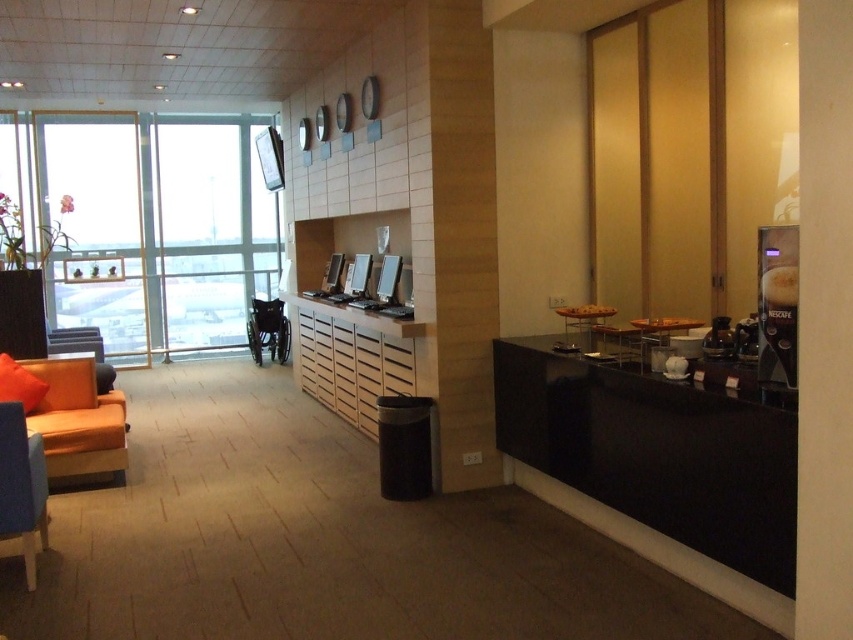
In the scene shown: Can you confirm if blue fabric chair at lower left is positioned above black plastic wheelchair at center?

No.

Is point (3, 456) positioned before point (287, 356)?

That is True.

Between point (15, 493) and point (271, 301), which one is positioned behind?

Point (271, 301)

The width and height of the screenshot is (853, 640). In order to click on blue fabric chair at lower left in this screenshot , I will do `click(21, 484)`.

Which of these two, transparent glass window at left or blue fabric chair at lower left, stands shorter?

blue fabric chair at lower left

Does transparent glass window at left have a lesser width compared to blue fabric chair at lower left?

Incorrect, transparent glass window at left's width is not less than blue fabric chair at lower left's.

Does point (274, 252) come in front of point (0, 493)?

That is False.

The image size is (853, 640). I want to click on transparent glass window at left, so click(x=155, y=224).

Does point (48, 358) lie behind point (10, 486)?

Yes, it is.

Identify the location of orange fabric couch at left. Image resolution: width=853 pixels, height=640 pixels. [x=78, y=422].